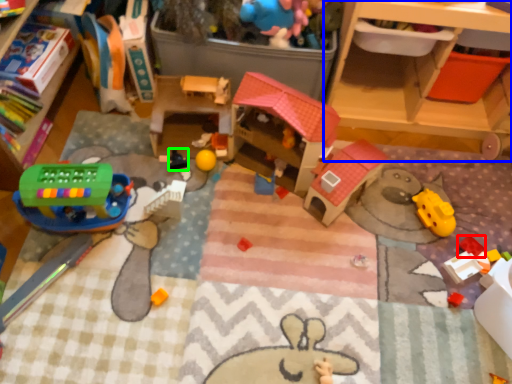
Question: Based on their relative distances, which object is farther from toy (highlighted by a red box)? Choose from shelf (highlighted by a blue box) and toy (highlighted by a green box).

Choices:
 (A) shelf
 (B) toy

Answer: (B)